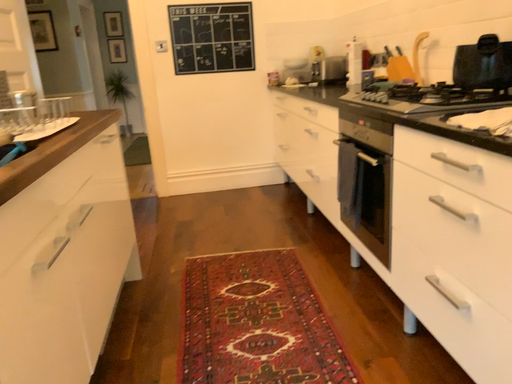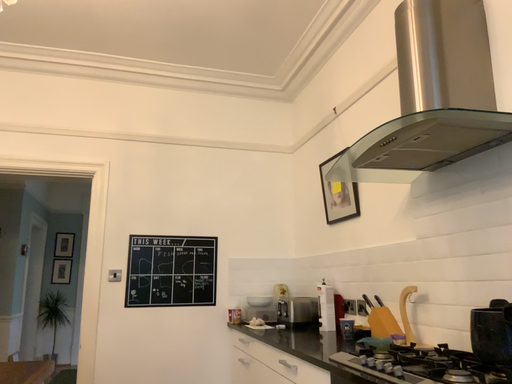
Question: Which way did the camera rotate in the video?

Choices:
 (A) rotated left
 (B) rotated right

Answer: (B)